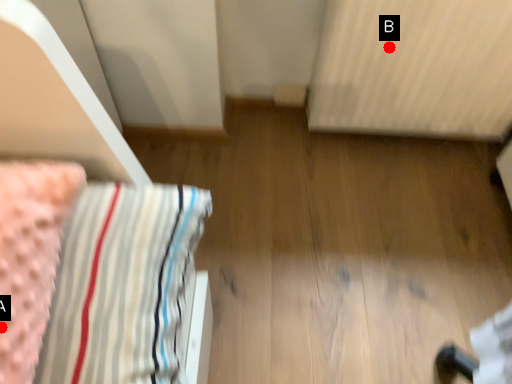
Question: Two points are circled on the image, labeled by A and B beside each circle. Which of the following is the farthest from the observer?

Choices:
 (A) A is further
 (B) B is further

Answer: (B)